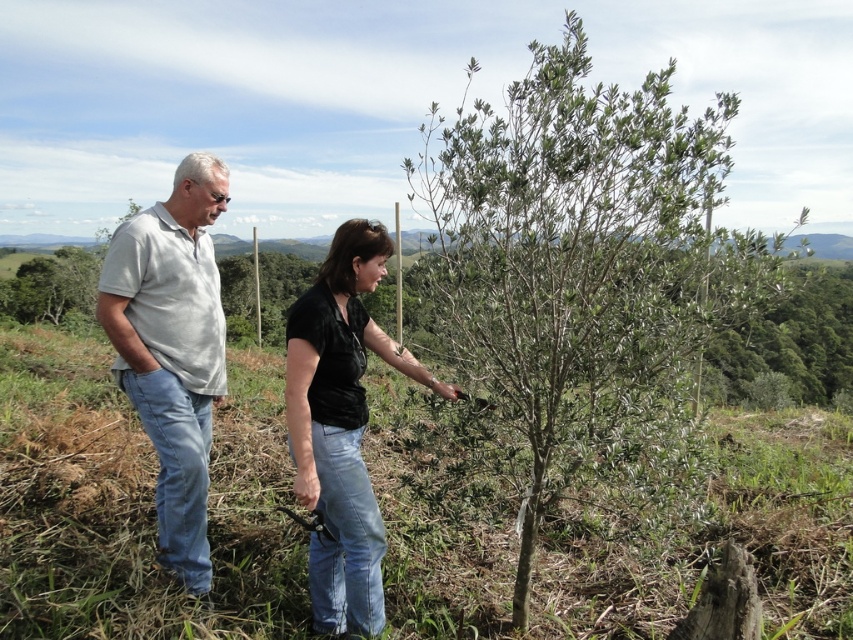
Question: Observing the image, what is the correct spatial positioning of gray cotton shirt at left in reference to black matte shirt at center?

Choices:
 (A) right
 (B) left

Answer: (B)

Question: Is green leafy shrub at center wider than gray cotton shirt at left?

Choices:
 (A) no
 (B) yes

Answer: (B)

Question: Observing the image, what is the correct spatial positioning of green leafy shrub at center in reference to gray cotton shirt at left?

Choices:
 (A) left
 (B) right

Answer: (B)

Question: Which of the following is the closest to the observer?

Choices:
 (A) (413, 173)
 (B) (132, 365)

Answer: (A)

Question: Estimate the real-world distances between objects in this image. Which object is farther from the green leafy shrub at center?

Choices:
 (A) black matte shirt at center
 (B) gray cotton shirt at left

Answer: (B)

Question: Which of the following is the farthest from the observer?

Choices:
 (A) (321, 392)
 (B) (210, 257)

Answer: (B)